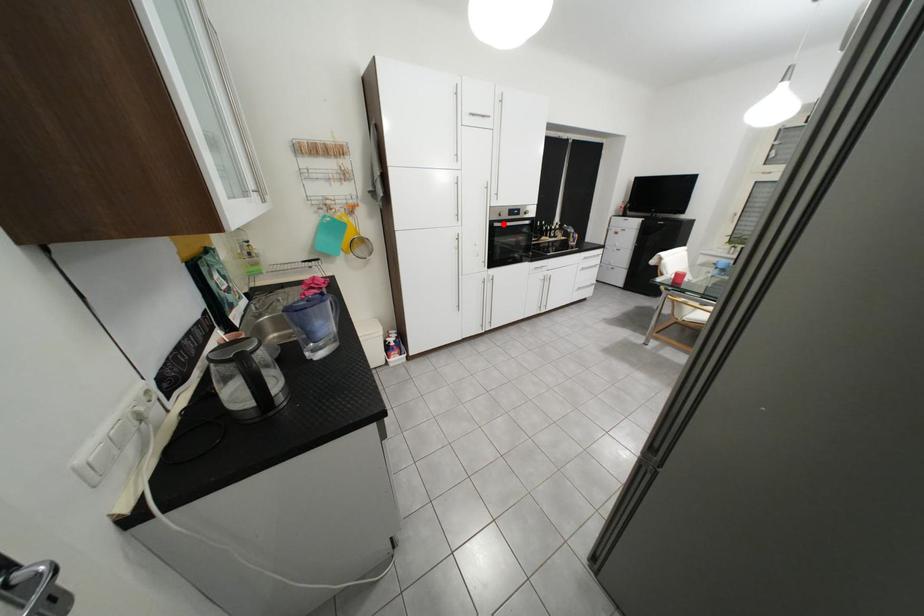
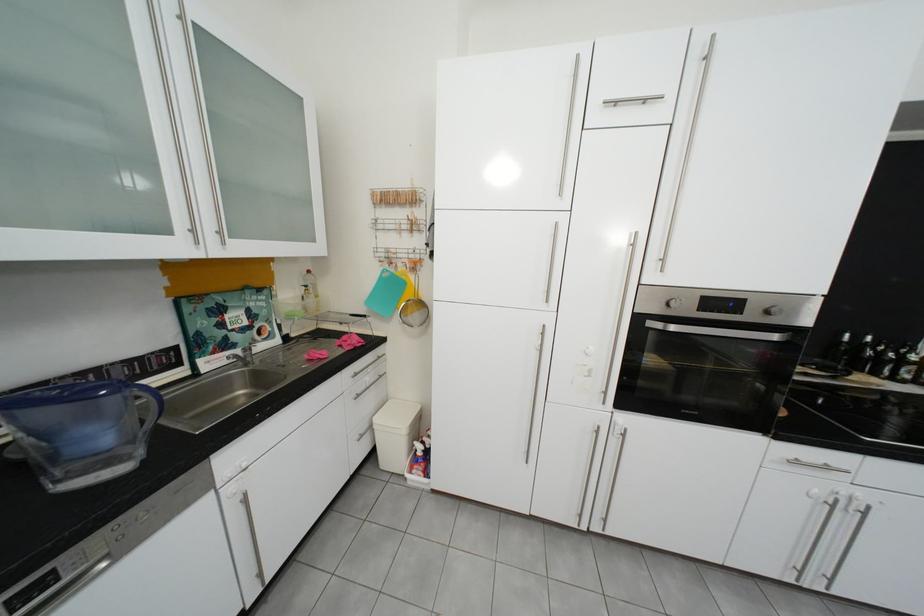
Question: I am providing you with two images of the same scene from different viewpoints. A red point is shown in image1. For the corresponding object point in image2, is it positioned nearer or farther from the camera?

Choices:
 (A) Nearer
 (B) Farther

Answer: (B)